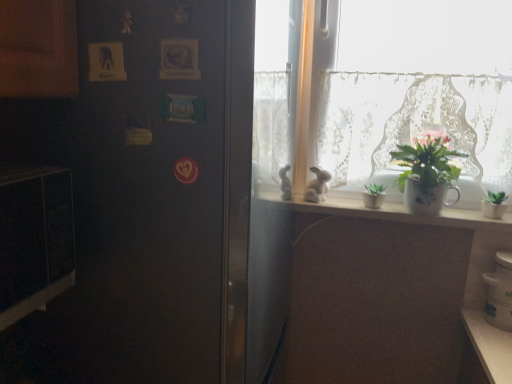
This screenshot has height=384, width=512. In order to click on free space above white wooden shelf at upper center (from a real-world perspective) in this screenshot , I will do `click(379, 205)`.